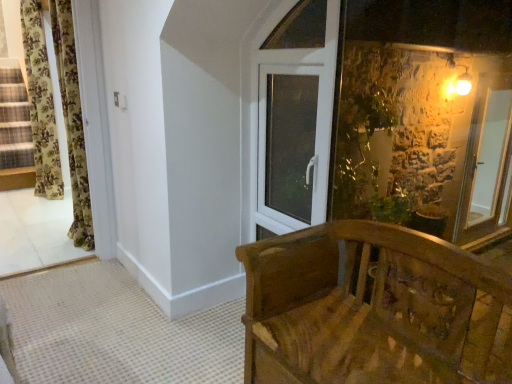
Question: From the image's perspective, is floral fabric curtain at left, marked as the second curtain in a back-to-front arrangement, on top of floral fabric curtain at left, arranged as the first curtain when viewed from the left?

Choices:
 (A) no
 (B) yes

Answer: (A)

Question: Is floral fabric curtain at left, arranged as the first curtain when viewed from the left, surrounded by floral fabric curtain at left, which is the first curtain from right to left?

Choices:
 (A) no
 (B) yes

Answer: (A)

Question: Considering the relative sizes of floral fabric curtain at left, the 1th curtain in the front-to-back sequence, and floral fabric curtain at left, arranged as the first curtain when viewed from the left, in the image provided, is floral fabric curtain at left, the 1th curtain in the front-to-back sequence, thinner than floral fabric curtain at left, arranged as the first curtain when viewed from the left,?

Choices:
 (A) no
 (B) yes

Answer: (B)

Question: Are floral fabric curtain at left, marked as the second curtain in a back-to-front arrangement, and floral fabric curtain at left, which is the second curtain from front to back, located far from each other?

Choices:
 (A) no
 (B) yes

Answer: (B)

Question: Is floral fabric curtain at left, marked as the second curtain in a back-to-front arrangement, closer to the viewer compared to floral fabric curtain at left, which is the second curtain from front to back?

Choices:
 (A) yes
 (B) no

Answer: (A)

Question: Is point (278, 120) positioned closer to the camera than point (438, 367)?

Choices:
 (A) closer
 (B) farther

Answer: (B)

Question: Considering the relative positions of white plastic window at upper center and wooden carved bench at lower right in the image provided, is white plastic window at upper center to the left or to the right of wooden carved bench at lower right?

Choices:
 (A) left
 (B) right

Answer: (A)

Question: In terms of width, does white plastic window at upper center look wider or thinner when compared to wooden carved bench at lower right?

Choices:
 (A) thin
 (B) wide

Answer: (A)

Question: Is white plastic window at upper center in front of or behind wooden carved bench at lower right in the image?

Choices:
 (A) behind
 (B) front

Answer: (A)

Question: From their relative heights in the image, would you say floral fabric curtain at left, arranged as the first curtain when viewed from the left, is taller or shorter than wooden carved bench at lower right?

Choices:
 (A) short
 (B) tall

Answer: (B)

Question: Choose the correct answer: Is floral fabric curtain at left, the second curtain viewed from the right, inside wooden carved bench at lower right or outside it?

Choices:
 (A) outside
 (B) inside

Answer: (A)

Question: From a real-world perspective, relative to wooden carved bench at lower right, is floral fabric curtain at left, positioned as the 1th curtain in back-to-front order, vertically above or below?

Choices:
 (A) above
 (B) below

Answer: (A)

Question: From the image's perspective, relative to wooden carved bench at lower right, is floral fabric curtain at left, which is the second curtain from front to back, above or below?

Choices:
 (A) above
 (B) below

Answer: (A)

Question: Looking at the image, does wooden carved bench at lower right seem bigger or smaller compared to white plastic window at upper center?

Choices:
 (A) big
 (B) small

Answer: (A)

Question: From a real-world perspective, is wooden carved bench at lower right physically located above or below white plastic window at upper center?

Choices:
 (A) above
 (B) below

Answer: (B)